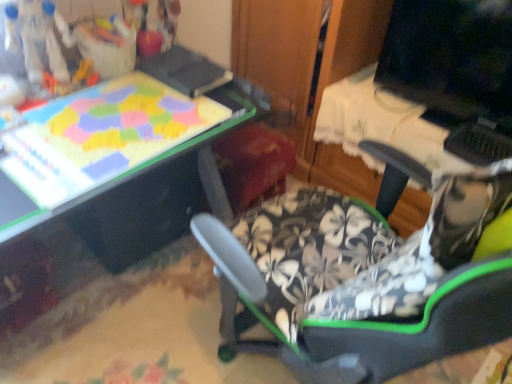
Question: In terms of size, does matte plastic puzzle board at upper left appear bigger or smaller than black plastic drawer at lower left?

Choices:
 (A) small
 (B) big

Answer: (A)

Question: In the image, is matte plastic puzzle board at upper left positioned in front of or behind black plastic drawer at lower left?

Choices:
 (A) front
 (B) behind

Answer: (A)

Question: Which object is positioned farthest from the black plastic drawer at lower left?

Choices:
 (A) matte plastic puzzle board at upper left
 (B) matte black monitor at upper right

Answer: (B)

Question: Estimate the real-world distances between objects in this image. Which object is closer to the black plastic drawer at lower left?

Choices:
 (A) matte black monitor at upper right
 (B) matte plastic puzzle board at upper left

Answer: (B)